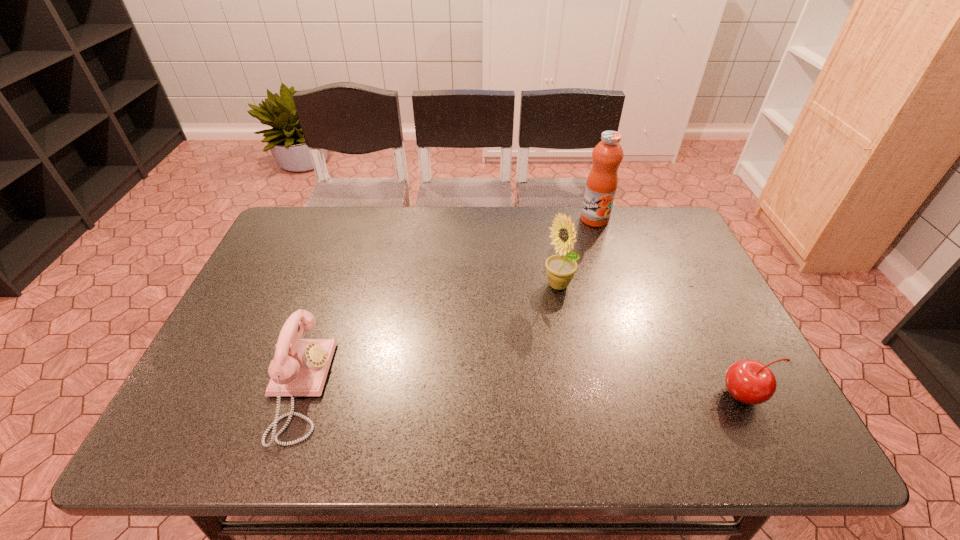
Locate an element on the screen. The image size is (960, 540). the leftmost object is located at coordinates (300, 366).

This screenshot has width=960, height=540. I want to click on the third tallest object, so click(x=300, y=366).

The image size is (960, 540). Find the location of `the shortest object`. the shortest object is located at coordinates (750, 382).

I want to click on cherry, so click(750, 382).

Find the location of a particular element. Image resolution: width=960 pixels, height=540 pixels. sunflower is located at coordinates (560, 269).

This screenshot has width=960, height=540. Identify the location of the second object from left to right. (560, 269).

Locate an element on the screen. The height and width of the screenshot is (540, 960). fruit juice is located at coordinates (607, 155).

At what (x,y) coordinates should I click in order to perform the action: click on the farthest object. Please return your answer as a coordinate pair (x, y). The image size is (960, 540). Looking at the image, I should click on (607, 155).

What are the coordinates of `vacant space located on the dial of the leftmost object` in the screenshot? It's located at (366, 388).

What are the coordinates of `vacant space located on the back of the rightmost object` in the screenshot? It's located at (685, 277).